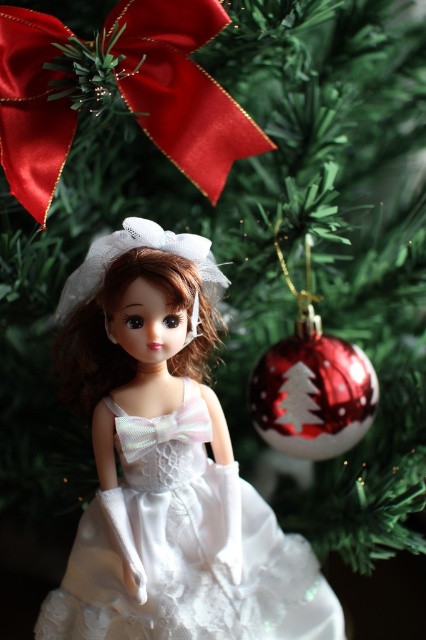
Question: Is white satin dress at center bigger than satin/red bow at upper left?

Choices:
 (A) no
 (B) yes

Answer: (B)

Question: Which point is closer to the camera?

Choices:
 (A) (195, 634)
 (B) (8, 113)

Answer: (B)

Question: Which point is farther to the camera?

Choices:
 (A) (109, 605)
 (B) (140, 97)

Answer: (A)

Question: Does white satin dress at center have a smaller size compared to satin/red bow at upper left?

Choices:
 (A) no
 (B) yes

Answer: (A)

Question: Which object is closer to the camera taking this photo?

Choices:
 (A) white satin dress at center
 (B) satin/red bow at upper left

Answer: (B)

Question: Considering the relative positions of white satin dress at center and satin/red bow at upper left in the image provided, where is white satin dress at center located with respect to satin/red bow at upper left?

Choices:
 (A) above
 (B) below

Answer: (B)